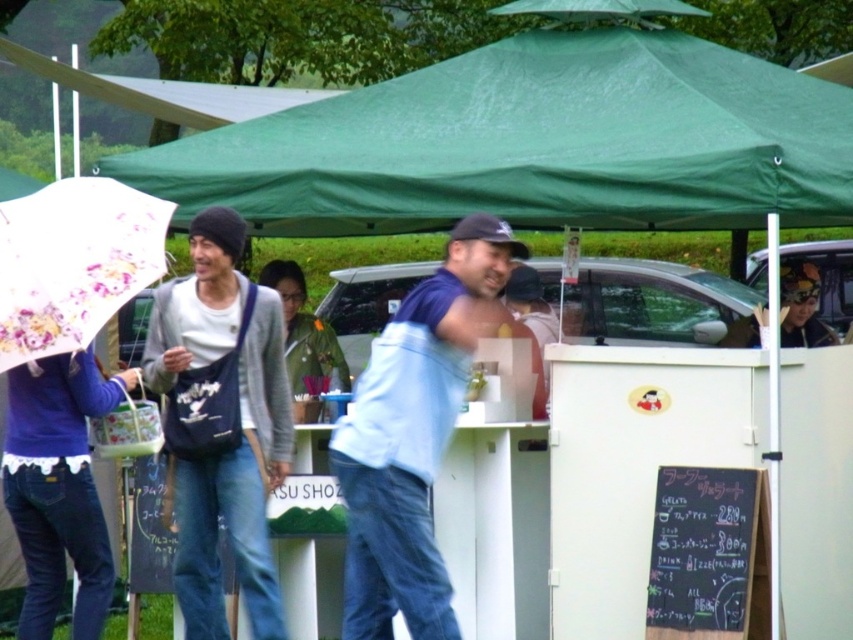
Between light blue fabric jacket at center and floral paper umbrella at left, which one has more height?

light blue fabric jacket at center is taller.

Is point (463, 244) positioned behind point (73, 316)?

No.

You are a GUI agent. You are given a task and a screenshot of the screen. Output one action in this format:
    pyautogui.click(x=<x>, y=<y>)
    Task: Click on the light blue fabric jacket at center
    The height and width of the screenshot is (640, 853).
    Given the screenshot: What is the action you would take?
    pyautogui.click(x=415, y=435)

Does point (519, 36) come in front of point (218, 448)?

No, it is not.

Find the location of a particular element. This screenshot has height=640, width=853. green fabric canopy at upper center is located at coordinates (531, 145).

Looking at this image, which is more to the left, green fabric canopy at upper center or floral paper umbrella at left?

Positioned to the left is floral paper umbrella at left.

How distant is green fabric canopy at upper center from floral paper umbrella at left?

green fabric canopy at upper center is 1.38 meters away from floral paper umbrella at left.

Which is in front, point (732, 77) or point (77, 276)?

Point (77, 276) is more forward.

Find the location of a particular element. green fabric canopy at upper center is located at coordinates (531, 145).